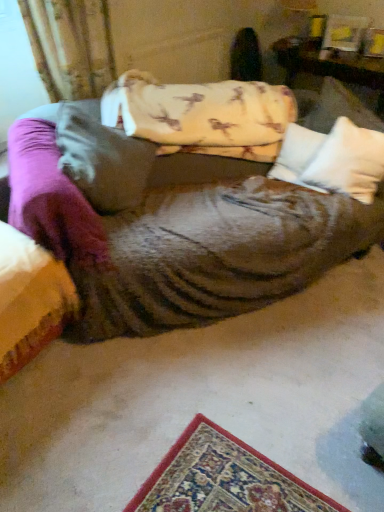
Question: Considering the relative positions of wooden table at upper right and white soft pillow at center, which is the 2th pillow from right to left, in the image provided, is wooden table at upper right in front of white soft pillow at center, which is the 2th pillow from right to left,?

Choices:
 (A) no
 (B) yes

Answer: (A)

Question: Is wooden table at upper right shorter than white soft pillow at center, which is the 2th pillow from right to left?

Choices:
 (A) yes
 (B) no

Answer: (B)

Question: Can you confirm if wooden table at upper right is smaller than white soft pillow at center, which is the 2th pillow from right to left?

Choices:
 (A) no
 (B) yes

Answer: (A)

Question: Is wooden table at upper right outside of white soft pillow at center, which is the 2th pillow from right to left?

Choices:
 (A) no
 (B) yes

Answer: (B)

Question: Is wooden table at upper right at the left side of white soft pillow at center, placed as the 2th pillow when sorted from left to right?

Choices:
 (A) yes
 (B) no

Answer: (B)

Question: Is white soft pillow at center, which is the 2th pillow from right to left, wider or thinner than fluffy white pillow at center, positioned as the first pillow in left-to-right order?

Choices:
 (A) thin
 (B) wide

Answer: (A)

Question: Choose the correct answer: Is white soft pillow at center, which is the 2th pillow from right to left, inside fluffy white pillow at center, positioned as the first pillow in left-to-right order, or outside it?

Choices:
 (A) inside
 (B) outside

Answer: (B)

Question: From the image's perspective, relative to fluffy white pillow at center, positioned as the first pillow in left-to-right order, is white soft pillow at center, placed as the 2th pillow when sorted from left to right, above or below?

Choices:
 (A) above
 (B) below

Answer: (A)

Question: Is point (284, 163) closer or farther from the camera than point (140, 177)?

Choices:
 (A) farther
 (B) closer

Answer: (A)

Question: Do you think wooden table at upper right is within white soft pillow at center, placed as the 2th pillow when sorted from left to right, or outside of it?

Choices:
 (A) inside
 (B) outside

Answer: (B)

Question: Looking at the image, does wooden table at upper right seem bigger or smaller compared to white soft pillow at center, placed as the 2th pillow when sorted from left to right?

Choices:
 (A) big
 (B) small

Answer: (A)

Question: Considering the positions of wooden table at upper right and white soft pillow at center, placed as the 2th pillow when sorted from left to right, in the image, is wooden table at upper right taller or shorter than white soft pillow at center, placed as the 2th pillow when sorted from left to right,?

Choices:
 (A) short
 (B) tall

Answer: (B)

Question: Considering the positions of wooden table at upper right and white soft pillow at center, which is the 2th pillow from right to left, in the image, is wooden table at upper right wider or thinner than white soft pillow at center, which is the 2th pillow from right to left,?

Choices:
 (A) thin
 (B) wide

Answer: (B)

Question: From a real-world perspective, is white soft pillow at center, the 1th pillow positioned from the right, above or below white soft pillow at center, placed as the 2th pillow when sorted from left to right?

Choices:
 (A) above
 (B) below

Answer: (A)

Question: Considering their positions, is white soft pillow at center, the 1th pillow positioned from the right, located in front of or behind white soft pillow at center, placed as the 2th pillow when sorted from left to right?

Choices:
 (A) front
 (B) behind

Answer: (A)